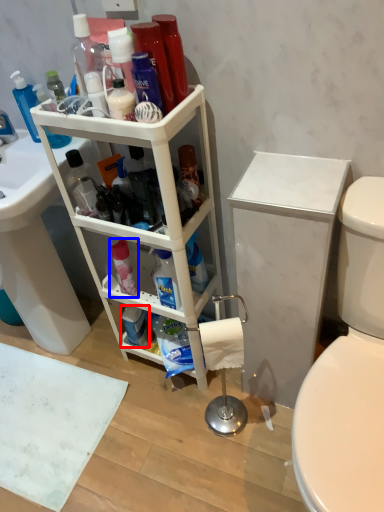
Question: Among these objects, which one is farthest to the camera, toiletry (highlighted by a red box) or cleaning product (highlighted by a blue box)?

Choices:
 (A) toiletry
 (B) cleaning product

Answer: (A)